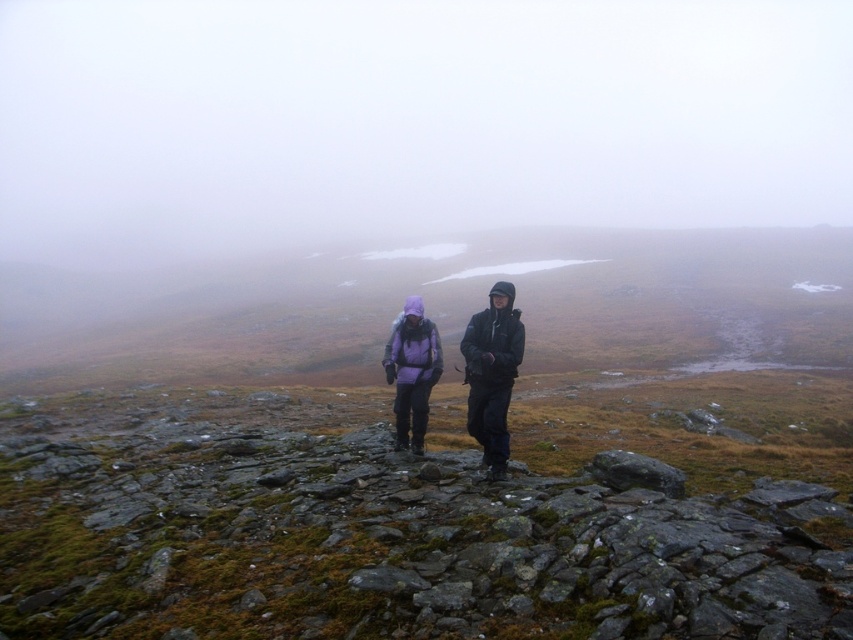
How distant is matte purple jacket at center from dark gray jacket at center?

matte purple jacket at center is 19.96 centimeters away from dark gray jacket at center.

Between point (492, 317) and point (479, 353), which one is positioned in front?

Point (479, 353)

You are a GUI agent. You are given a task and a screenshot of the screen. Output one action in this format:
    pyautogui.click(x=<x>, y=<y>)
    Task: Click on the matte purple jacket at center
    The height and width of the screenshot is (640, 853).
    Given the screenshot: What is the action you would take?
    pyautogui.click(x=492, y=372)

Is point (505, 460) less distant than point (422, 356)?

Yes, point (505, 460) is in front of point (422, 356).

Who is more forward, (483, 368) or (416, 397)?

Point (483, 368) is more forward.

Where is `matte purple jacket at center`? Image resolution: width=853 pixels, height=640 pixels. matte purple jacket at center is located at coordinates (492, 372).

Which is more to the right, dark gray jacket at center or purple fleece jacket at center?

From the viewer's perspective, dark gray jacket at center appears more on the right side.

This screenshot has height=640, width=853. I want to click on dark gray jacket at center, so click(x=492, y=372).

Which is behind, point (474, 346) or point (415, 349)?

Point (415, 349)

Where is `dark gray jacket at center`? The width and height of the screenshot is (853, 640). dark gray jacket at center is located at coordinates (492, 372).